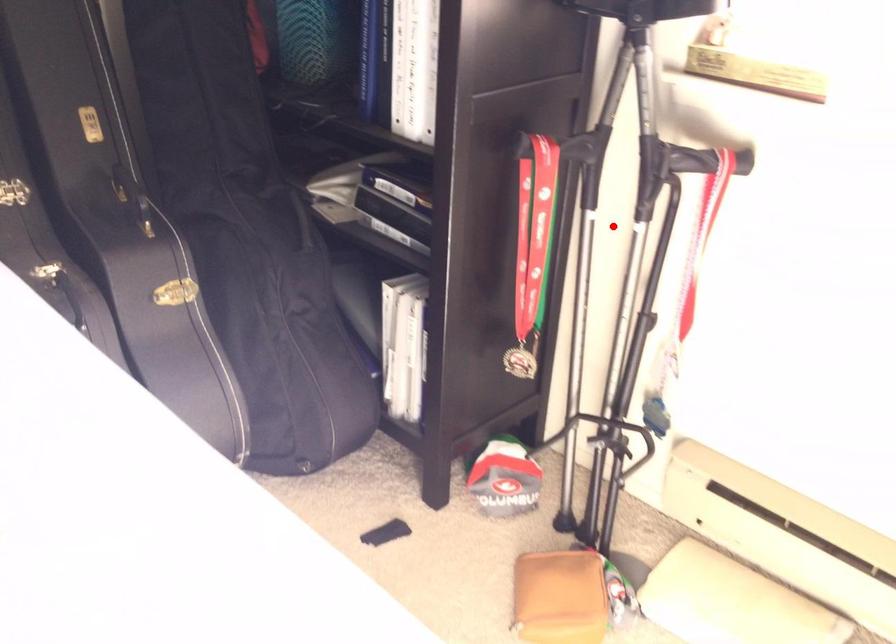
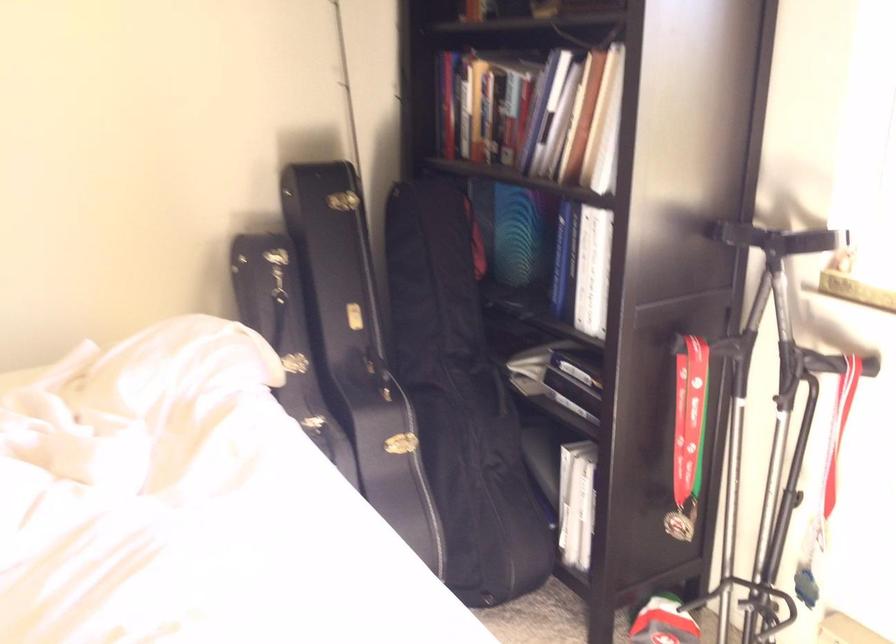
Question: I am providing you with two images of the same scene from different viewpoints. A red point is marked on the first image. At the location where the point appears in image 1, is it still visible in image 2?

Choices:
 (A) Yes
 (B) No

Answer: (A)